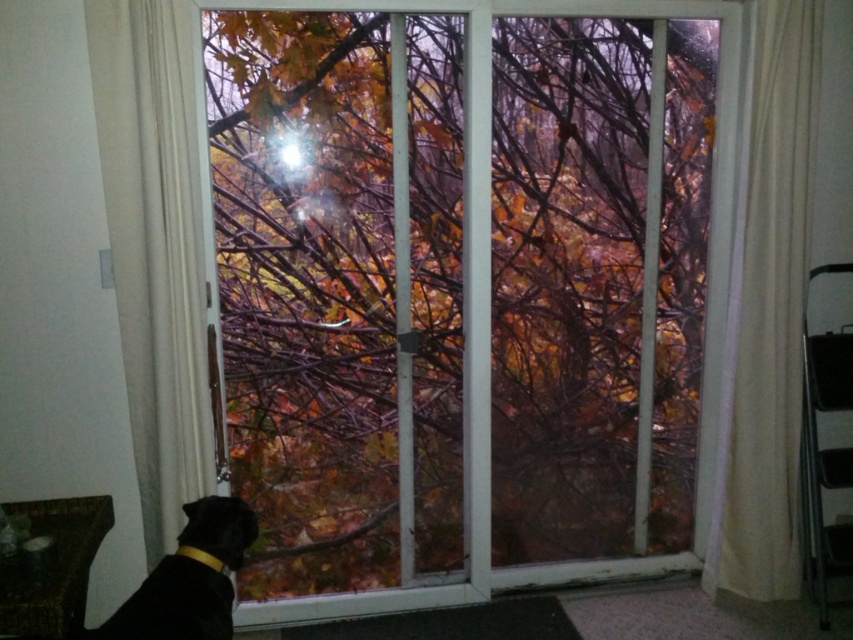
Question: Can you confirm if transparent glass window at center is positioned to the right of black fur dog at lower left?

Choices:
 (A) no
 (B) yes

Answer: (B)

Question: Does white fabric curtain at right have a greater width compared to transparent glass window at center?

Choices:
 (A) yes
 (B) no

Answer: (B)

Question: Which point appears farthest from the camera in this image?

Choices:
 (A) 752,67
 (B) 140,625

Answer: (A)

Question: Which of the following is the farthest from the observer?

Choices:
 (A) (90, 74)
 (B) (225, 616)
 (C) (738, 499)

Answer: (C)

Question: Which object is the farthest from the transparent glass window at center?

Choices:
 (A) white sheer curtain at left
 (B) black fur dog at lower left

Answer: (B)

Question: Can you confirm if transparent glass window at center is thinner than black fur dog at lower left?

Choices:
 (A) yes
 (B) no

Answer: (B)